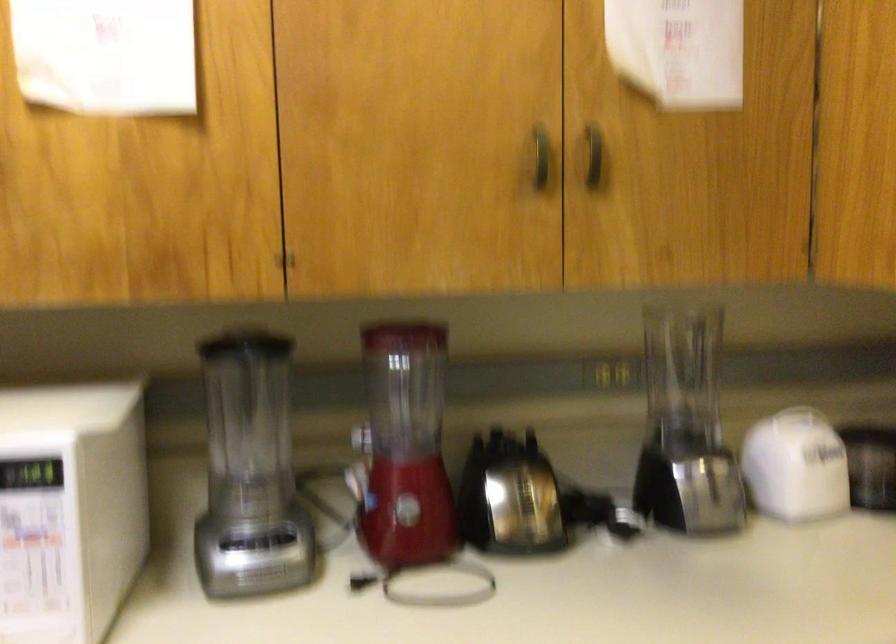
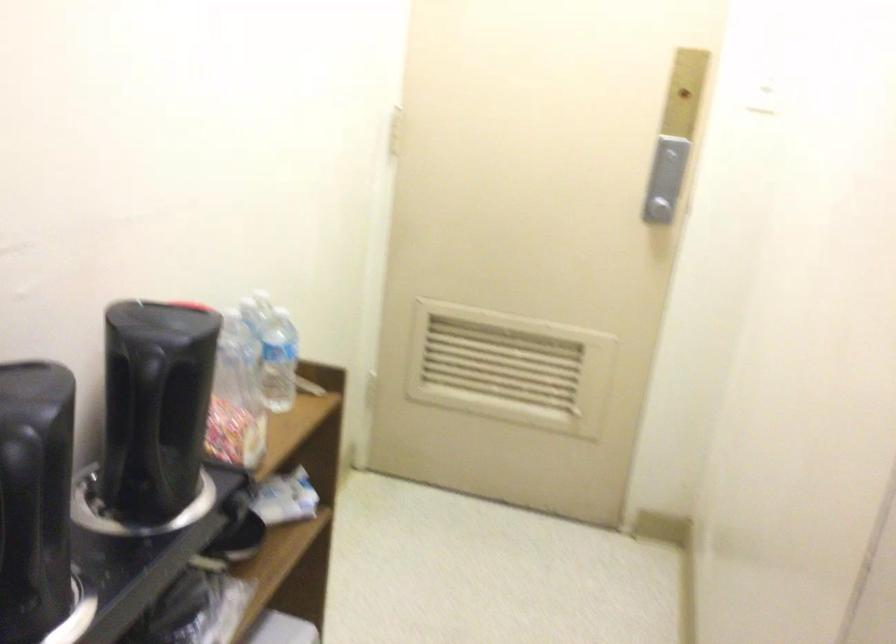
The images are taken continuously from a first-person perspective. In which direction is your viewpoint rotating?

The camera rotated toward left-down.